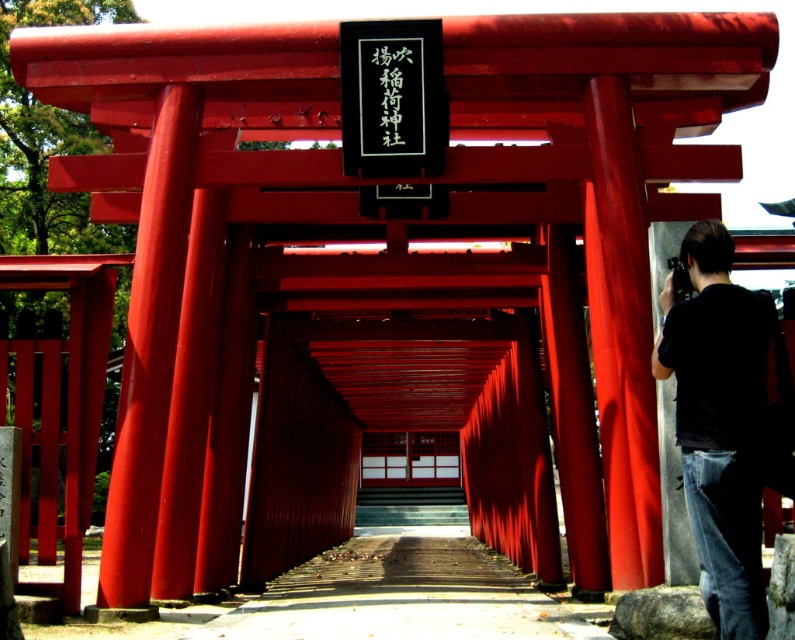
You are a photographer standing in front of the torii gate. You want to take a picture that includes both the black cotton shirt at right and the wooden planks at center. Based on their positions, which object should you place on the right side of your frame to ensure both are visible?

The black cotton shirt at right is positioned on the right side of wooden planks at center. To include both in the frame, you should place the wooden planks at center on the left side of your frame and the black cotton shirt at right on the right side.